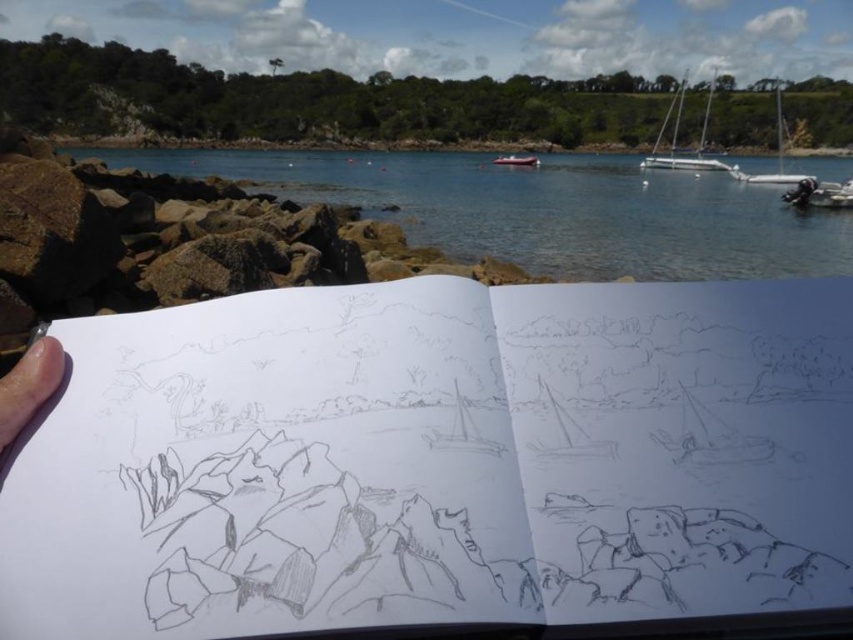
This screenshot has height=640, width=853. What do you see at coordinates (28, 387) in the screenshot?
I see `skin/soft/hand at lower left` at bounding box center [28, 387].

Between point (10, 440) and point (498, 163), which one is positioned in front?

Point (10, 440) is more forward.

Is point (38, 378) farther from camera compared to point (520, 164)?

No, it is in front of (520, 164).

Identify the location of skin/soft/hand at lower left. (28, 387).

Between pencil sketchbook at center and clear blue water at center, which one has more height?

clear blue water at center is taller.

Is pencil sketchbook at center to the left of clear blue water at center from the viewer's perspective?

Indeed, pencil sketchbook at center is positioned on the left side of clear blue water at center.

Image resolution: width=853 pixels, height=640 pixels. What do you see at coordinates (440, 465) in the screenshot?
I see `pencil sketchbook at center` at bounding box center [440, 465].

The width and height of the screenshot is (853, 640). Find the location of `pencil sketchbook at center`. pencil sketchbook at center is located at coordinates (440, 465).

Is pencil sketchbook at center to the left of white sailboat at upper right from the viewer's perspective?

Indeed, pencil sketchbook at center is positioned on the left side of white sailboat at upper right.

Which is in front, point (300, 589) or point (732, 173)?

Point (300, 589)

Locate an element on the screen. pencil sketchbook at center is located at coordinates (440, 465).